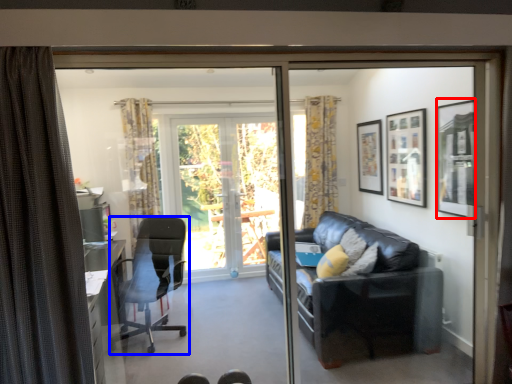
Question: Among these objects, which one is nearest to the camera, picture frame (highlighted by a red box) or chair (highlighted by a blue box)?

Choices:
 (A) picture frame
 (B) chair

Answer: (A)